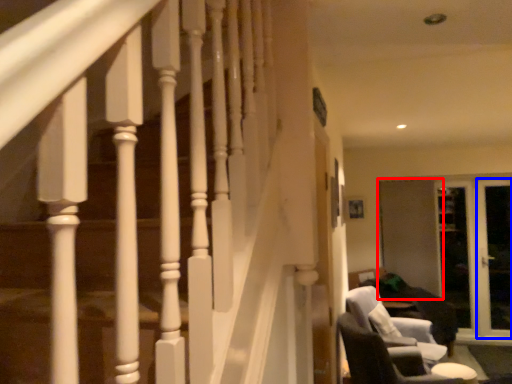
Question: Among these objects, which one is nearest to the camera, screen door (highlighted by a red box) or screen door (highlighted by a blue box)?

Choices:
 (A) screen door
 (B) screen door

Answer: (B)